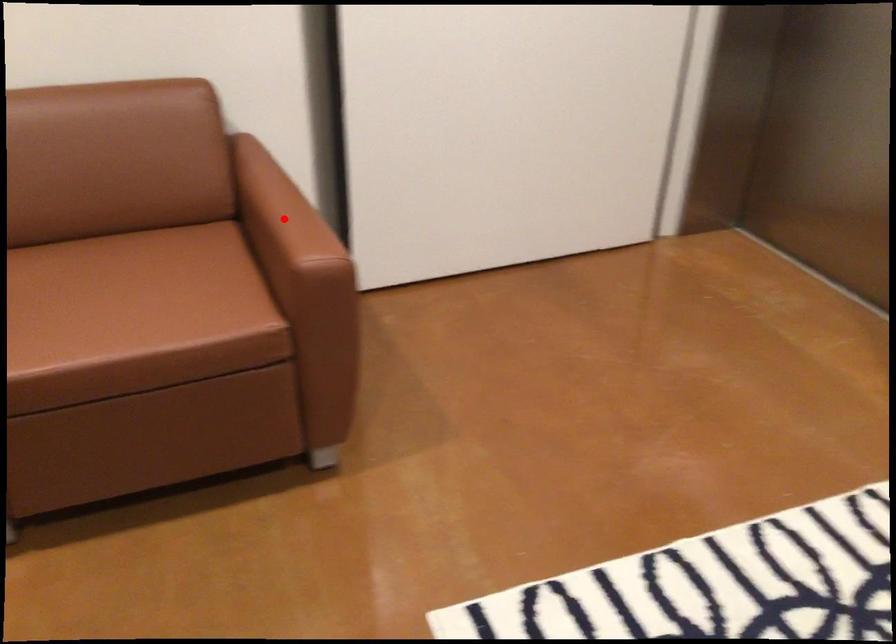
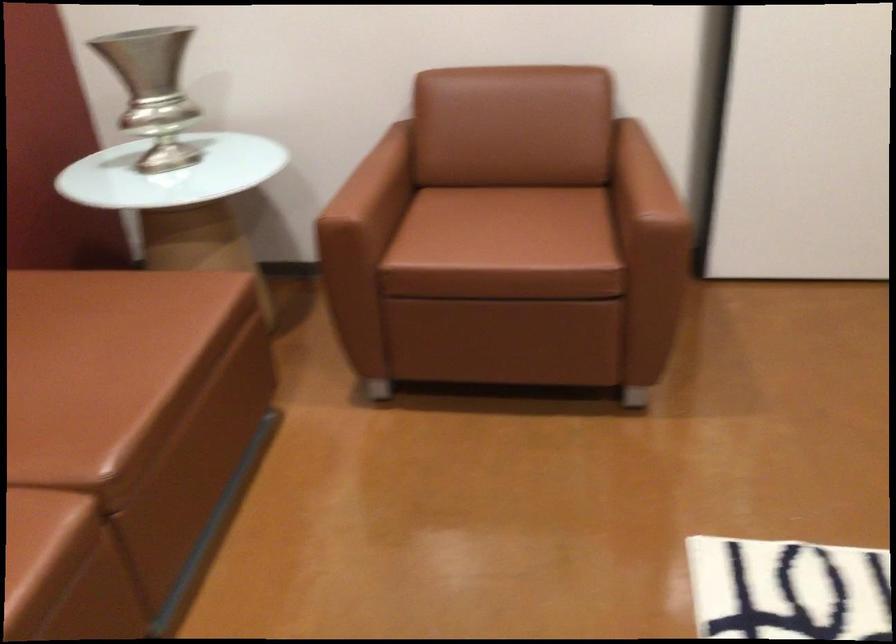
In the second image, find the point that corresponds to the highlighted location in the first image.

(643, 180)